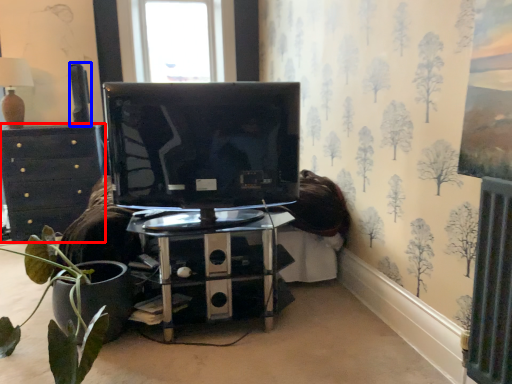
Question: Which point is further to the camera, chest of drawers (highlighted by a red box) or speaker (highlighted by a blue box)?

Choices:
 (A) chest of drawers
 (B) speaker

Answer: (B)